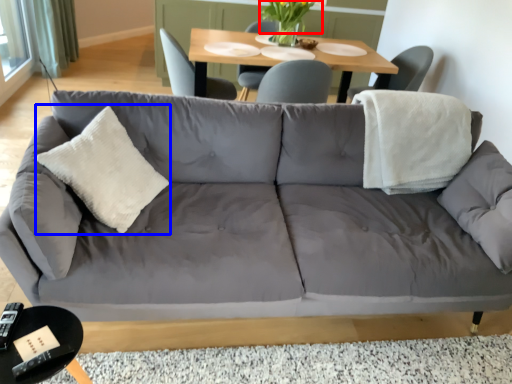
Question: Which of the following is the closest to the observer, flower (highlighted by a red box) or throw pillow (highlighted by a blue box)?

Choices:
 (A) flower
 (B) throw pillow

Answer: (B)